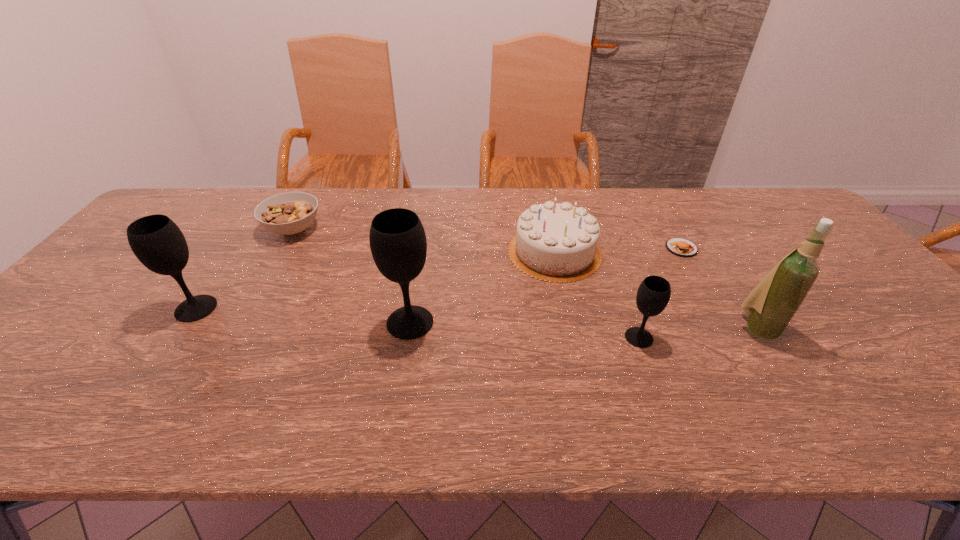
The width and height of the screenshot is (960, 540). I want to click on free space between the fifth object from right to left and the stew, so pyautogui.click(x=351, y=276).

Locate an element on the screen. The image size is (960, 540). object that ranks as the second closest to the stew is located at coordinates (398, 244).

Where is `object that is the fourth closest one to the rightmost wineglass`? The width and height of the screenshot is (960, 540). object that is the fourth closest one to the rightmost wineglass is located at coordinates (398, 244).

Choose which wineglass is the third nearest neighbor to the patty. Please provide its 2D coordinates. Your answer should be formatted as a tuple, i.e. [(x, y)], where the tuple contains the x and y coordinates of a point satisfying the conditions above.

[(158, 243)]

You are a GUI agent. You are given a task and a screenshot of the screen. Output one action in this format:
    pyautogui.click(x=<x>, y=<y>)
    Task: Click on the wineglass that stands as the closest to the birthday cake
    
    Given the screenshot: What is the action you would take?
    pyautogui.click(x=653, y=295)